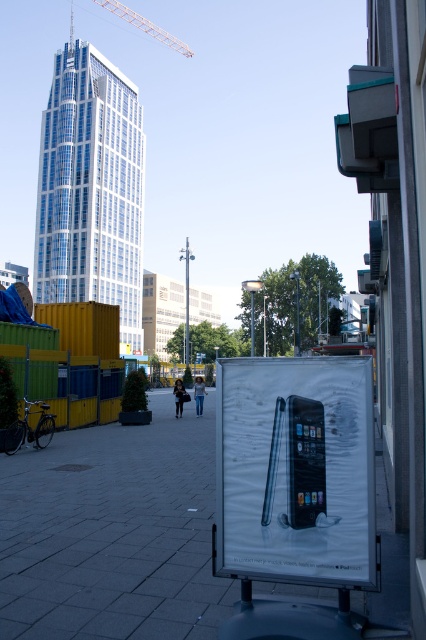
Question: Which point is closer to the camera taking this photo?

Choices:
 (A) (261, 536)
 (B) (14, 554)

Answer: (A)

Question: Does smooth concrete pavement at center come behind metallic silver phone at center?

Choices:
 (A) yes
 (B) no

Answer: (A)

Question: From the image, what is the correct spatial relationship of smooth concrete pavement at center in relation to metallic silver phone at center?

Choices:
 (A) left
 (B) right

Answer: (A)

Question: Is smooth concrete pavement at center positioned in front of metallic silver phone at center?

Choices:
 (A) no
 (B) yes

Answer: (A)

Question: Which point appears farthest from the camera in this image?

Choices:
 (A) (294, 364)
 (B) (0, 481)

Answer: (B)